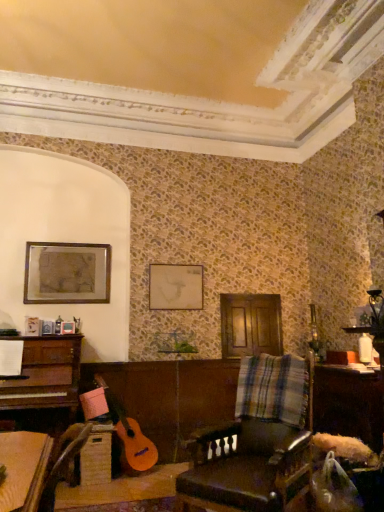
Question: From the image's perspective, does matte gold picture frame at upper left, which is the 2th picture frame from right to left, appear lower than leather at center?

Choices:
 (A) yes
 (B) no

Answer: (B)

Question: Considering the relative positions of matte gold picture frame at upper left, which ranks as the first picture frame in left-to-right order, and leather at center in the image provided, is matte gold picture frame at upper left, which ranks as the first picture frame in left-to-right order, to the left of leather at center from the viewer's perspective?

Choices:
 (A) yes
 (B) no

Answer: (A)

Question: Considering the relative sizes of matte gold picture frame at upper left, which ranks as the first picture frame in left-to-right order, and leather at center in the image provided, is matte gold picture frame at upper left, which ranks as the first picture frame in left-to-right order, thinner than leather at center?

Choices:
 (A) yes
 (B) no

Answer: (A)

Question: Is matte gold picture frame at upper left, which is the 2th picture frame from right to left, located outside leather at center?

Choices:
 (A) yes
 (B) no

Answer: (A)

Question: From a real-world perspective, is matte gold picture frame at upper left, which ranks as the first picture frame in left-to-right order, under leather at center?

Choices:
 (A) yes
 (B) no

Answer: (B)

Question: From a real-world perspective, is matte gold picture frame at upper left, which ranks as the first picture frame in left-to-right order, on leather at center?

Choices:
 (A) no
 (B) yes

Answer: (B)

Question: Considering the relative sizes of leather at center and matte gold picture frame at upper left, which is the 2th picture frame from right to left, in the image provided, is leather at center wider than matte gold picture frame at upper left, which is the 2th picture frame from right to left,?

Choices:
 (A) no
 (B) yes

Answer: (B)

Question: Is leather at center at the left side of matte gold picture frame at upper left, which ranks as the first picture frame in left-to-right order?

Choices:
 (A) yes
 (B) no

Answer: (B)

Question: Considering the relative sizes of leather at center and matte gold picture frame at upper left, which ranks as the first picture frame in left-to-right order, in the image provided, is leather at center shorter than matte gold picture frame at upper left, which ranks as the first picture frame in left-to-right order,?

Choices:
 (A) yes
 (B) no

Answer: (B)

Question: From a real-world perspective, does leather at center stand above matte gold picture frame at upper left, which ranks as the first picture frame in left-to-right order?

Choices:
 (A) yes
 (B) no

Answer: (B)

Question: Is leather at center positioned with its back to matte gold picture frame at upper left, which ranks as the first picture frame in left-to-right order?

Choices:
 (A) no
 (B) yes

Answer: (A)

Question: Would you say leather at center contains matte gold picture frame at upper left, which ranks as the first picture frame in left-to-right order?

Choices:
 (A) no
 (B) yes

Answer: (A)

Question: Is matte white picture frame at center, which ranks as the 2th picture frame in left-to-right order, not within matte gold picture frame at upper left, which ranks as the first picture frame in left-to-right order?

Choices:
 (A) no
 (B) yes

Answer: (B)